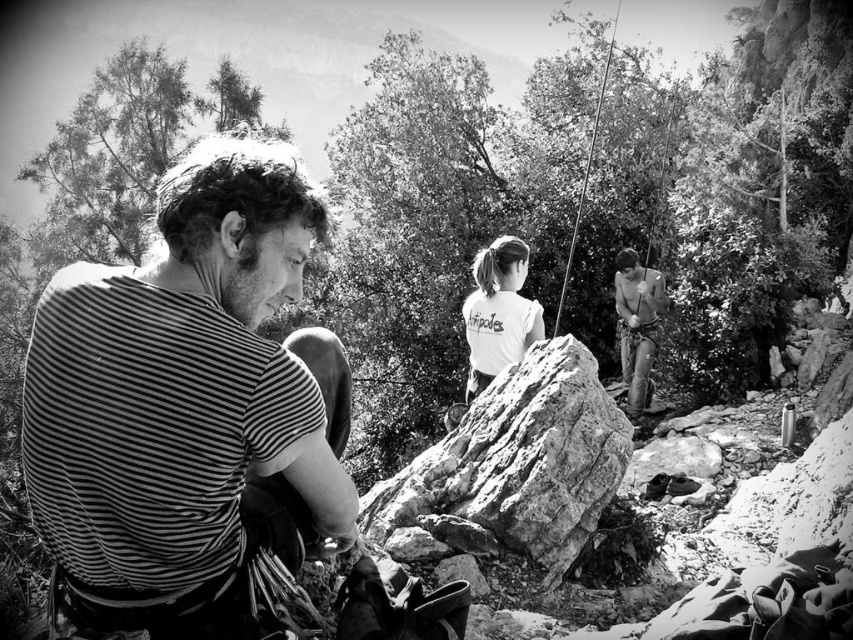
In the scene shown: You are a hiker trying to locate the climber wearing the striped fabric shirt at left and the rough textured rock at center. Based on the scene, which object is located to the left?

The striped fabric shirt at left is positioned on the left side of rough textured rock at center, so the striped fabric shirt at left is located to the left.

You are a photographer analyzing this black and white photo of a rock climbing scene. You need to determine the position of the striped fabric shirt at left relative to the dense vegetation in the background. Based on the coordinates provided, can you confirm if the shirt is positioned to the left or right of the vegetation?

The striped fabric shirt at left is located at point (x=189, y=403), which is to the right of the dense vegetation in the background since the coordinates place it further along the horizontal axis towards the right side of the image.

You are a hiker planning to place a 6.5 feet long ladder between the striped fabric shirt at left and the rough textured rock at center. Can the ladder fit between them without bending?

The distance between the striped fabric shirt at left and the rough textured rock at center is 7.28 feet. Since the ladder is 6.5 feet long, it can fit between them without bending as it is shorter than the distance available.